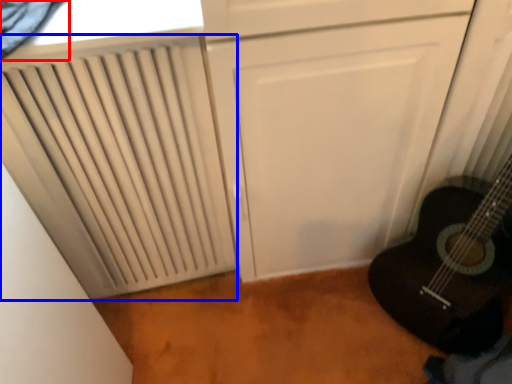
Question: Which object appears farthest to the camera in this image, curtain (highlighted by a red box) or radiator (highlighted by a blue box)?

Choices:
 (A) curtain
 (B) radiator

Answer: (B)